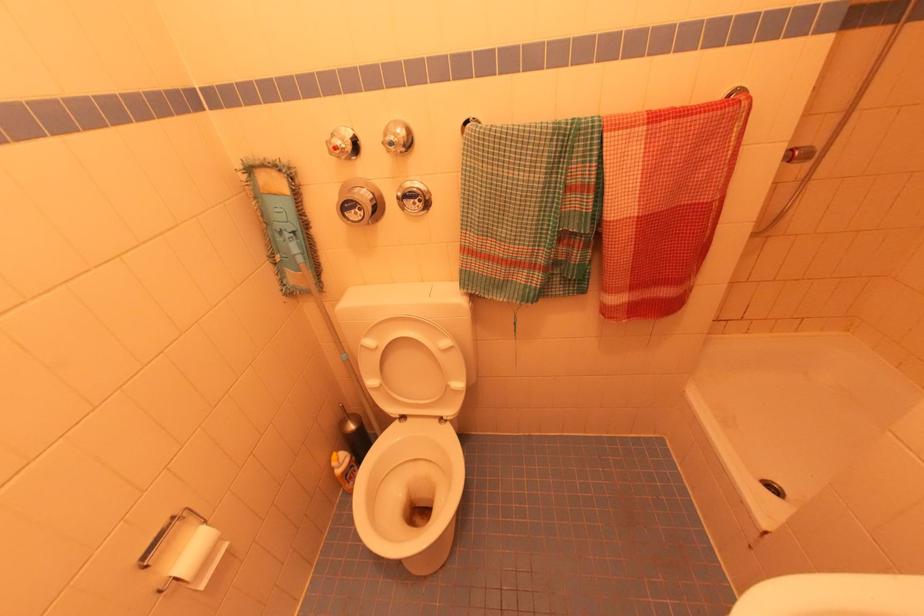
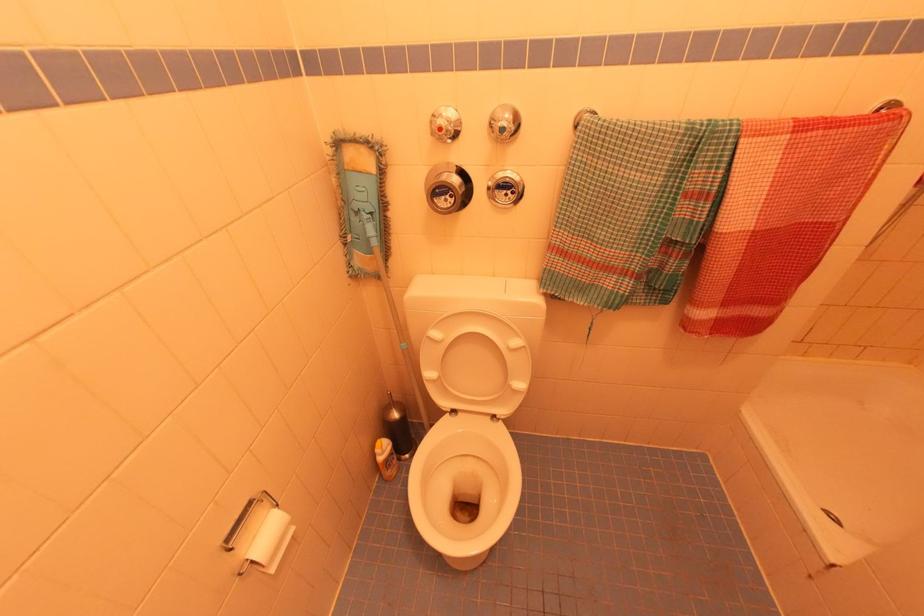
In the second image, find the point that corresponds to pixel 274 265 in the first image.

(344, 246)